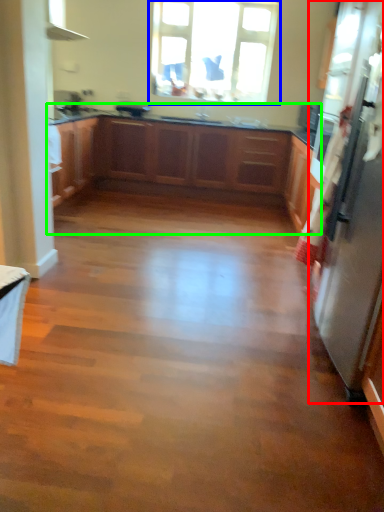
Question: Which object is the farthest from appliance (highlighted by a red box)? Choose among these: window (highlighted by a blue box) or cabinetry (highlighted by a green box).

Choices:
 (A) window
 (B) cabinetry

Answer: (A)